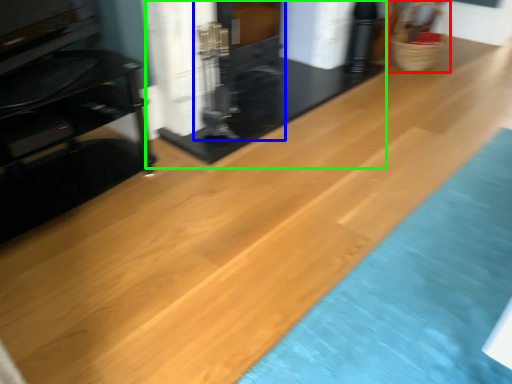
Question: Which object is the farthest from basket (highlighted by a red box)? Choose among these: fireplace (highlighted by a blue box) or fireplace (highlighted by a green box).

Choices:
 (A) fireplace
 (B) fireplace

Answer: (A)